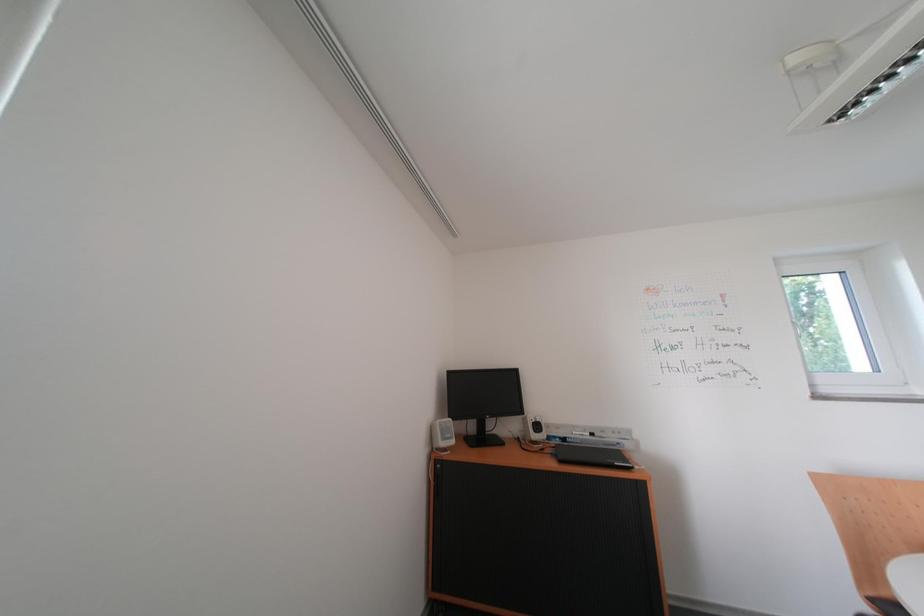
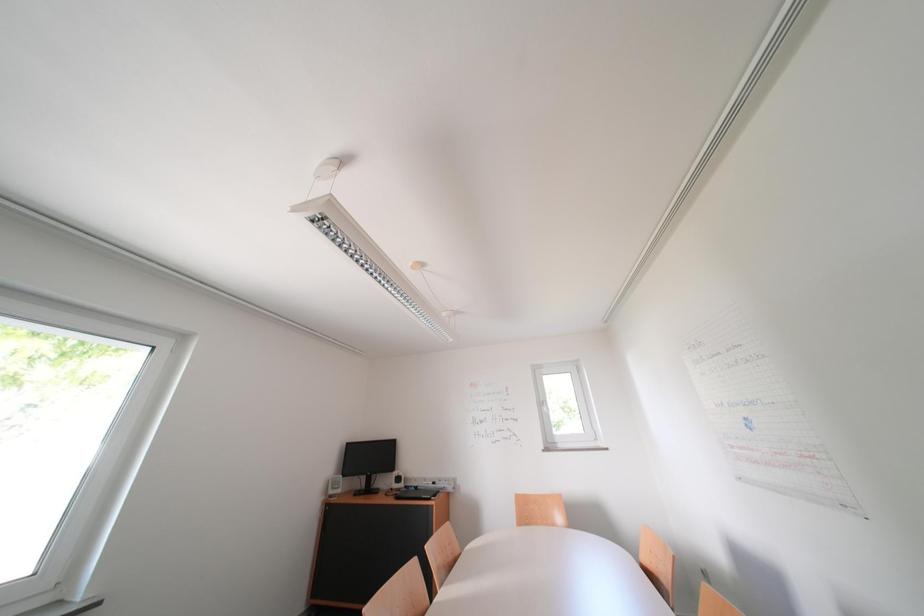
Which direction would the cameraman need to move to produce the second image?

The cameraman walked toward right, backward.